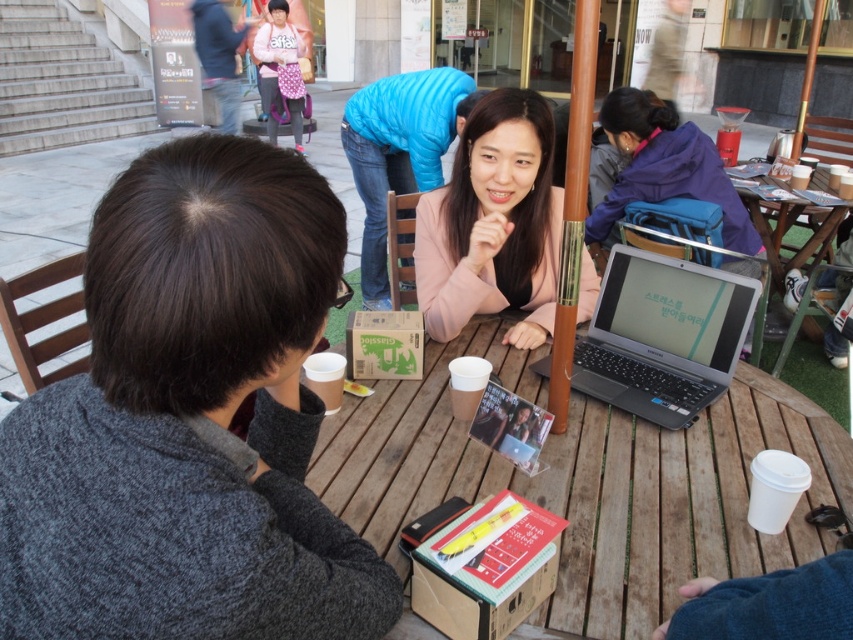
You are a delivery person who needs to place a large package on the table. The package requires 3 meters of space. Can you fit it on the wooden table at center or the wooden picnic table at right?

The distance between the wooden table at center and wooden picnic table at right is 2.59 meters, which is less than the required 3 meters. Therefore, the package cannot be placed on either table as there isn not enough space between them.